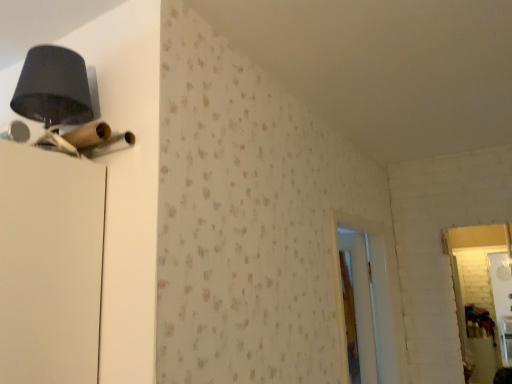
Question: Is matte black lampshade at upper left looking in the opposite direction of white wooden screen door at center?

Choices:
 (A) yes
 (B) no

Answer: (A)

Question: Is matte black lampshade at upper left at the left side of white wooden screen door at center?

Choices:
 (A) no
 (B) yes

Answer: (B)

Question: From a real-world perspective, is matte black lampshade at upper left beneath white wooden screen door at center?

Choices:
 (A) no
 (B) yes

Answer: (A)

Question: Considering the relative sizes of matte black lampshade at upper left and white wooden screen door at center in the image provided, is matte black lampshade at upper left smaller than white wooden screen door at center?

Choices:
 (A) yes
 (B) no

Answer: (A)

Question: From the image's perspective, does matte black lampshade at upper left appear higher than white wooden screen door at center?

Choices:
 (A) yes
 (B) no

Answer: (A)

Question: Is matte black lampshade at upper left positioned beyond the bounds of white wooden screen door at center?

Choices:
 (A) no
 (B) yes

Answer: (B)

Question: Can you confirm if white wooden screen door at center is taller than matte black lampshade at upper left?

Choices:
 (A) yes
 (B) no

Answer: (A)

Question: From a real-world perspective, is white wooden screen door at center on top of matte black lampshade at upper left?

Choices:
 (A) no
 (B) yes

Answer: (A)

Question: Is white wooden screen door at center shorter than matte black lampshade at upper left?

Choices:
 (A) no
 (B) yes

Answer: (A)

Question: Is the position of white wooden screen door at center more distant than that of matte black lampshade at upper left?

Choices:
 (A) no
 (B) yes

Answer: (B)

Question: Can you confirm if white wooden screen door at center is positioned to the right of matte black lampshade at upper left?

Choices:
 (A) yes
 (B) no

Answer: (A)

Question: From the image's perspective, would you say white wooden screen door at center is positioned over matte black lampshade at upper left?

Choices:
 (A) yes
 (B) no

Answer: (B)

Question: In terms of height, does matte black lampshade at upper left look taller or shorter compared to white wooden screen door at center?

Choices:
 (A) tall
 (B) short

Answer: (B)